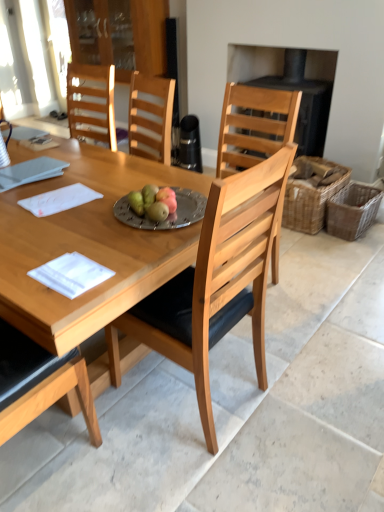
This screenshot has width=384, height=512. What are the coordinates of `free point above white paper at left, positioned as the third notepad in front-to-back order (from a real-world perspective)` in the screenshot? It's located at (24, 172).